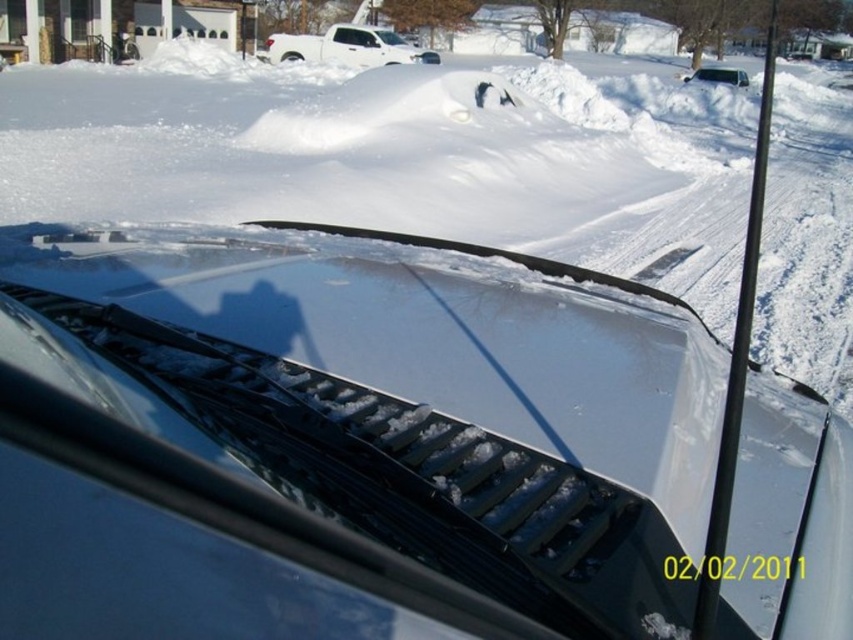
Does sleek silver hood at center lie in front of white matte truck at upper center?

Yes, sleek silver hood at center is in front of white matte truck at upper center.

How distant is sleek silver hood at center from white matte truck at upper center?

sleek silver hood at center is 25.95 meters from white matte truck at upper center.

Is point (344, 609) closer to camera compared to point (387, 36)?

Yes, point (344, 609) is in front of point (387, 36).

You are a GUI agent. You are given a task and a screenshot of the screen. Output one action in this format:
    pyautogui.click(x=<x>, y=<y>)
    Task: Click on the sleek silver hood at center
    
    Given the screenshot: What is the action you would take?
    pyautogui.click(x=344, y=440)

Which of these two, white fluffy snow at center or white matte van at upper center, stands shorter?

Standing shorter between the two is white matte van at upper center.

I want to click on white fluffy snow at center, so click(401, 156).

Which is in front, point (32, 163) or point (428, 56)?

Point (32, 163)

Can you confirm if white fluffy snow at center is shorter than white matte truck at upper center?

No.

This screenshot has width=853, height=640. In order to click on white fluffy snow at center in this screenshot , I will do `click(401, 156)`.